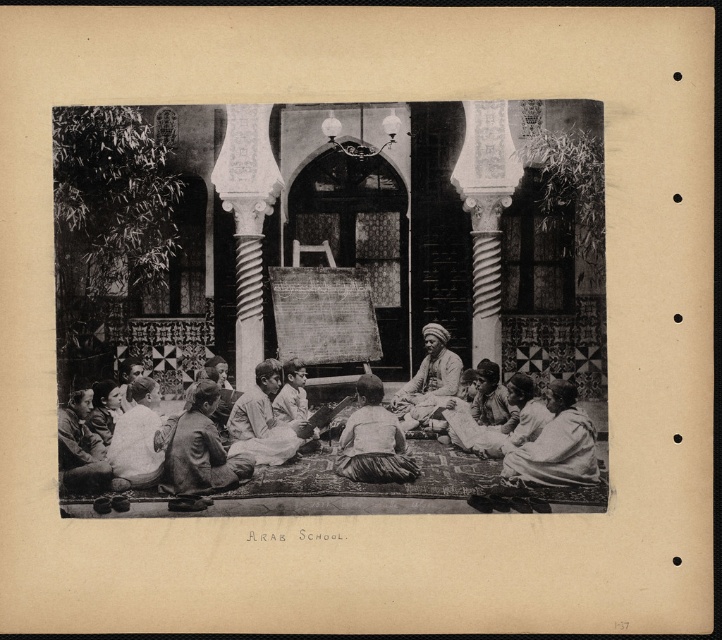
Who is lower down, light brown cotton shirt at center or smooth skin face at lower left?

Positioned lower is smooth skin face at lower left.

Who is more forward, (253, 369) or (92, 397)?

Point (92, 397) is more forward.

The image size is (722, 640). What do you see at coordinates (261, 420) in the screenshot? I see `light brown cotton shirt at center` at bounding box center [261, 420].

At what (x,y) coordinates should I click in order to perform the action: click on light brown cotton shirt at center. Please return your answer as a coordinate pair (x, y). Looking at the image, I should click on (261, 420).

Between light brown fabric at lower right and smooth skin face at lower left, which one appears on the left side from the viewer's perspective?

smooth skin face at lower left

Between light brown fabric at lower right and smooth skin face at lower left, which one is positioned lower?

Positioned lower is light brown fabric at lower right.

I want to click on light brown fabric at lower right, so click(556, 445).

Who is taller, light brown fabric at lower right or light beige fabric at lower left?

light beige fabric at lower left is taller.

Does point (526, 470) come farther from viewer compared to point (147, 396)?

No, (526, 470) is in front of (147, 396).

Where is `light brown fabric at lower right`? The image size is (722, 640). light brown fabric at lower right is located at coordinates (556, 445).